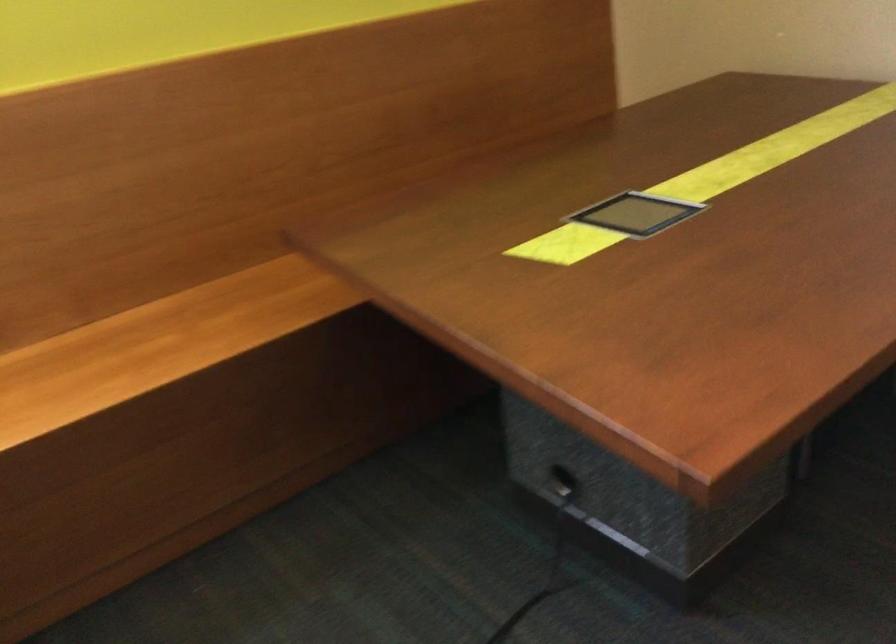
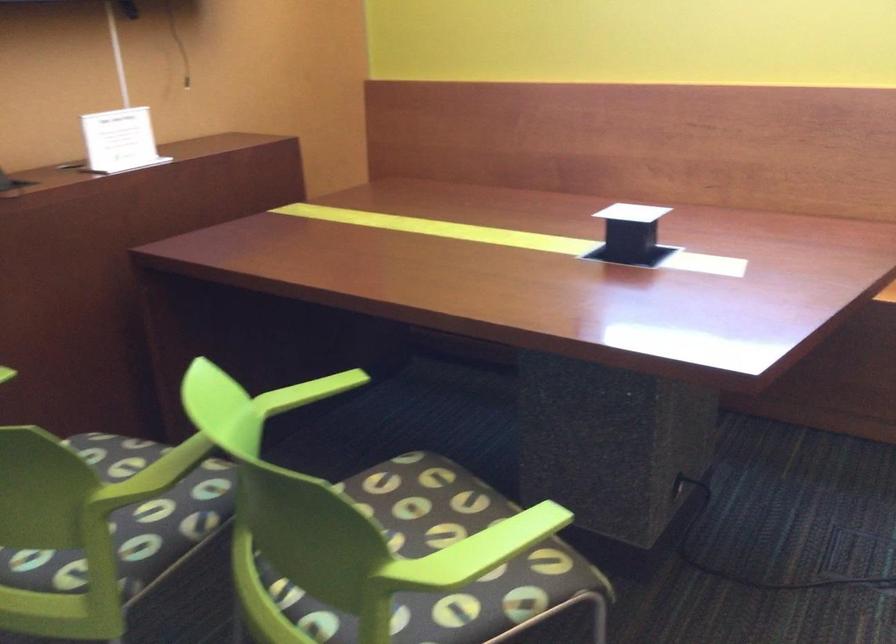
The images are taken continuously from a first-person perspective. In which direction is your viewpoint rotating?

The camera rotated toward left-down.